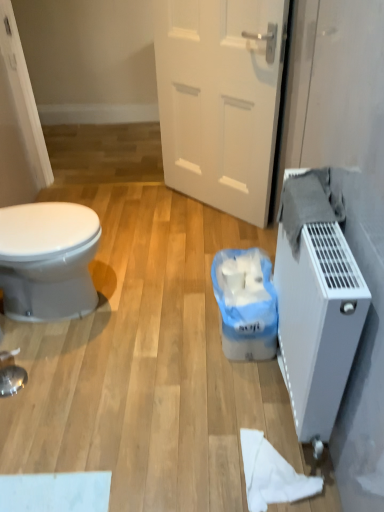
Where is `vacant space in white matte toilet paper at lower right (from a real-world perspective)`? The width and height of the screenshot is (384, 512). vacant space in white matte toilet paper at lower right (from a real-world perspective) is located at coordinates (276, 474).